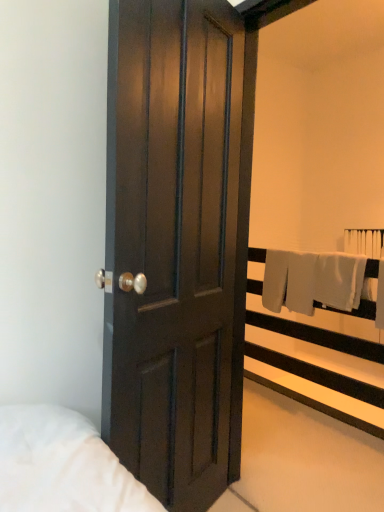
Identify the location of free spot in front of white fabric at upper right. Image resolution: width=384 pixels, height=512 pixels. (305, 438).